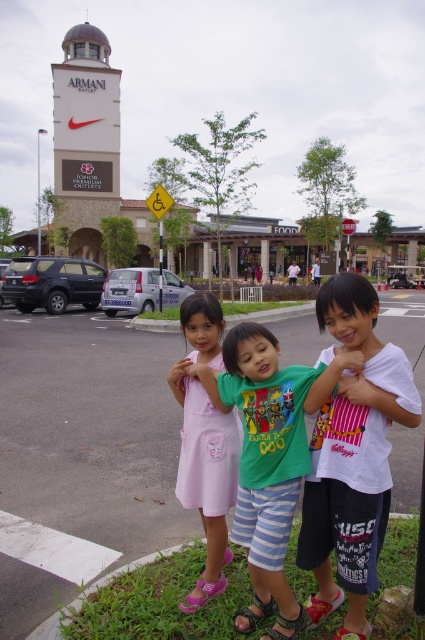
You are standing at the edge of the parking lot where the three children are playing. You need to walk to the asphalt pavement at center to retrieve an item you dropped there. According to the coordinates provided, in which direction should you walk from your current position?

The asphalt pavement at center is located at coordinates point (91, 429). Since you are at the edge of the parking lot near the children, you should walk towards the center of the parking lot to reach the asphalt pavement at center.

You are a photographer trying to capture a group photo of the children in the scene. You notice two children wearing white cotton shirt at center and green cotton shirt at center. Which child should you position closer to the camera to ensure their face is clearly visible in the photo?

The white cotton shirt at center should be positioned closer to the camera because it has a greater height compared to the green cotton shirt at center, allowing their face to be more visible.

You are standing at the entrance of Johor Premium Outlets and want to take a photo of the two points marked in the image. Which point, point (328, 412) or point (268, 518), will appear larger in your camera view?

Point (328, 412) will appear larger in your camera view because it is closer to the camera than point (268, 518).